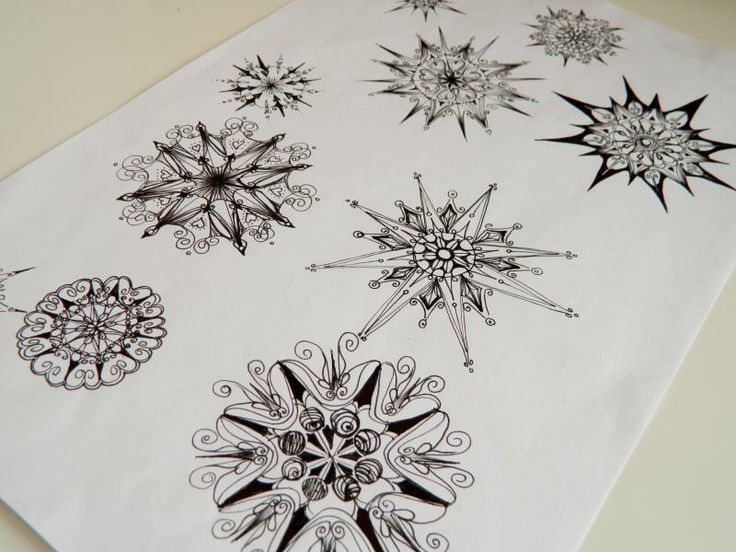
Find the location of a particular element. Image resolution: width=736 pixels, height=552 pixels. white table is located at coordinates (679, 488).